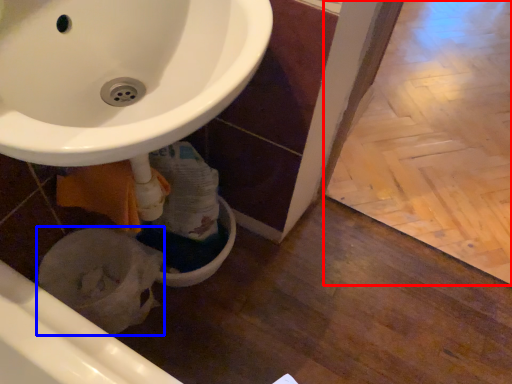
Question: Which object appears farthest to the camera in this image, tile (highlighted by a red box) or bidet (highlighted by a blue box)?

Choices:
 (A) tile
 (B) bidet

Answer: (A)